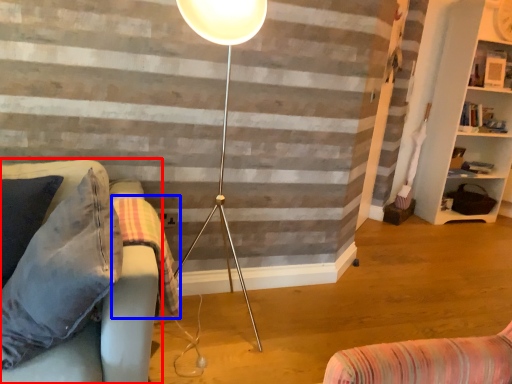
Question: Which point is further to the camera, studio couch (highlighted by a red box) or blanket (highlighted by a blue box)?

Choices:
 (A) studio couch
 (B) blanket

Answer: (B)